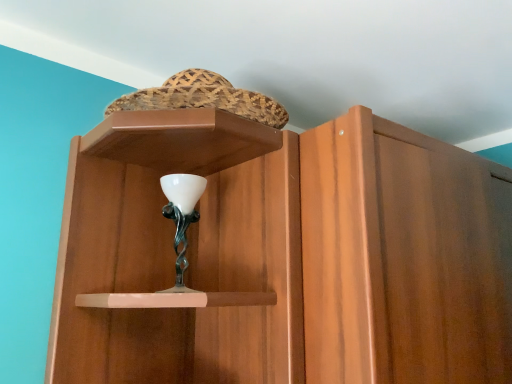
What is the approximate height of white glass candle holder at center?

11.02 inches.

You are a GUI agent. You are given a task and a screenshot of the screen. Output one action in this format:
    pyautogui.click(x=<x>, y=<y>)
    Task: Click on the white glass candle holder at center
    
    Given the screenshot: What is the action you would take?
    pyautogui.click(x=181, y=218)

What do you see at coordinates (181, 218) in the screenshot?
I see `white glass candle holder at center` at bounding box center [181, 218].

Identify the location of white glass candle holder at center. (181, 218).